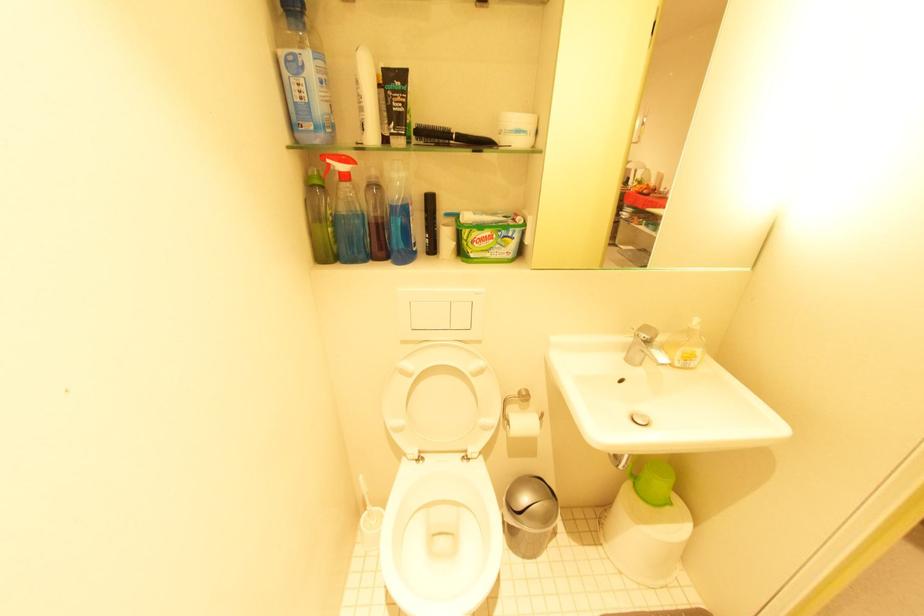
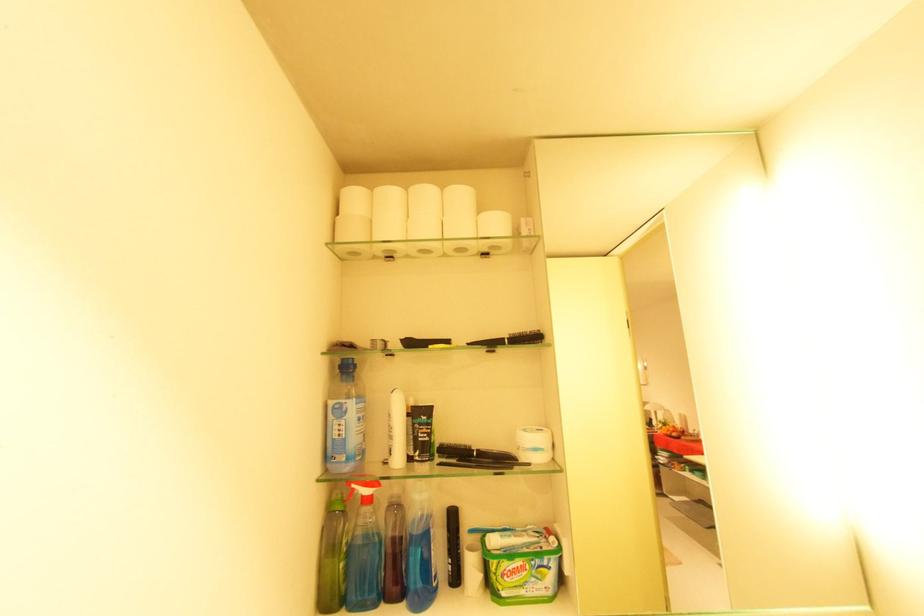
In the second image, find the point that corresponds to the point at 347,174 in the first image.

(370, 496)